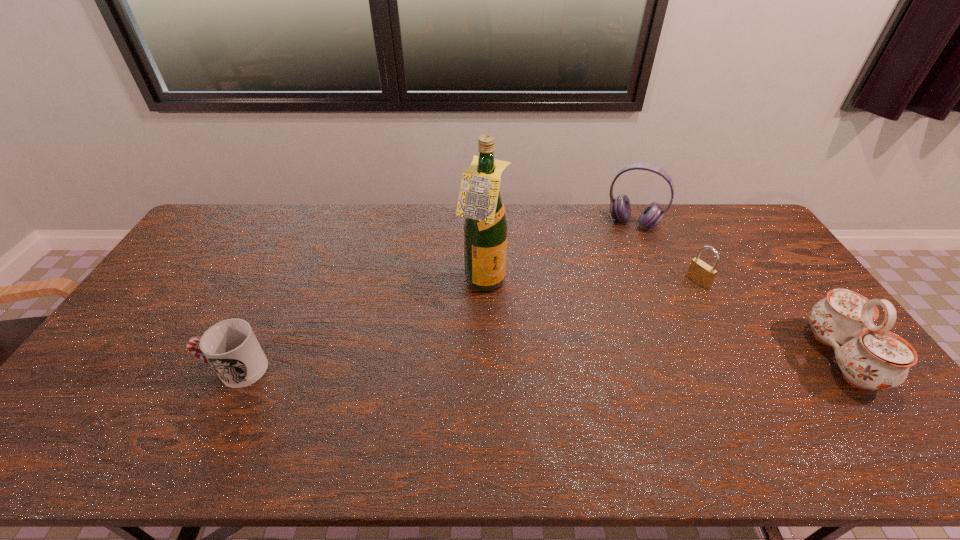
At what (x,y) coordinates should I click in order to perform the action: click on vacant space situated 0.260m on the front-facing side of the liquor. Please return your answer as a coordinate pair (x, y). Looking at the image, I should click on (575, 336).

Find the location of a particular element. object that is at the far edge is located at coordinates (620, 208).

Find the location of `cup present at the near edge`. cup present at the near edge is located at coordinates (230, 346).

In order to click on chinaware located at the near edge in this screenshot , I will do `click(871, 357)`.

The width and height of the screenshot is (960, 540). Identify the location of object located in the right edge section of the desktop. (871, 357).

Find the location of a particular element. object present at the near right corner is located at coordinates (871, 357).

Locate an element on the screen. vacant space at the far edge of the desktop is located at coordinates (321, 238).

In the image, there is a desktop. Where is `vacant space at the near edge`? Image resolution: width=960 pixels, height=540 pixels. vacant space at the near edge is located at coordinates [177, 406].

At what (x,y) coordinates should I click in order to perform the action: click on free spot at the left edge of the desktop. Please return your answer as a coordinate pair (x, y). This screenshot has width=960, height=540. Looking at the image, I should click on (175, 315).

Identify the location of vacant space at the right edge of the desktop. The image size is (960, 540). (788, 309).